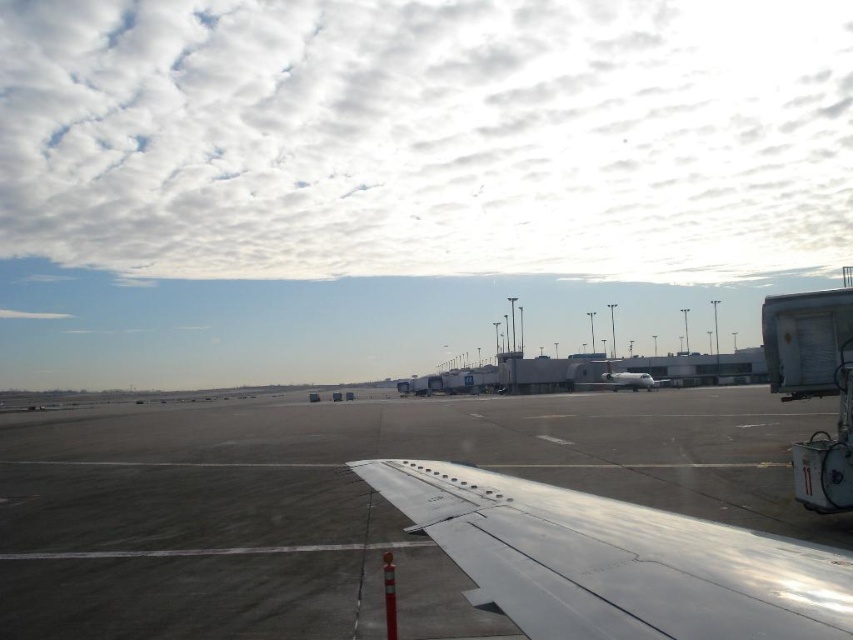
Looking at this image, you are a pilot preparing for takeoff and need to ensure there is enough space between the silver metallic wing at center and the gray matte tarmac at center to avoid any collision with nearby equipment. Based on the scene, which object is wider, and does this affect the clearance needed?

The gray matte tarmac at center is wider than the silver metallic wing at center. This means the tarmac provides sufficient width, so there should be enough clearance between the wing and the tarmac to avoid collisions with nearby equipment.

You are a pilot preparing for takeoff and looking out the window of the aircraft. You notice the cloudy sky at upper center and the white metallic airplane at center. Which object is located above the other?

The cloudy sky at upper center is positioned over the white metallic airplane at center, meaning the cloudy sky at upper center is above the white metallic airplane at center.